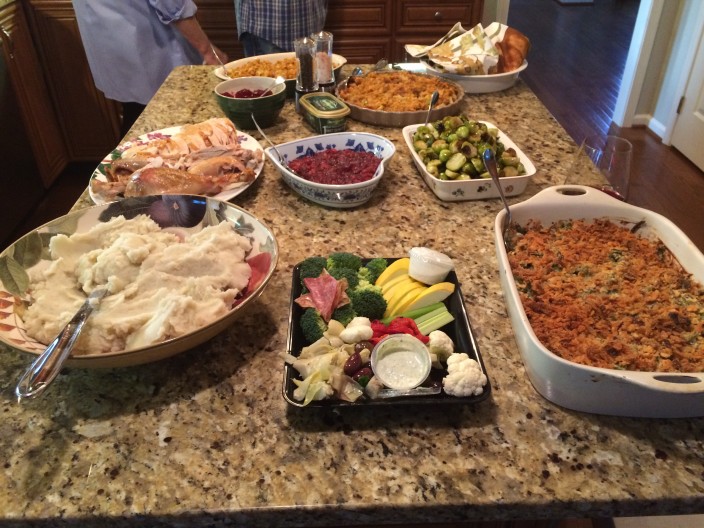
Where is `plastic platter`? The width and height of the screenshot is (704, 528). plastic platter is located at coordinates (467, 336).